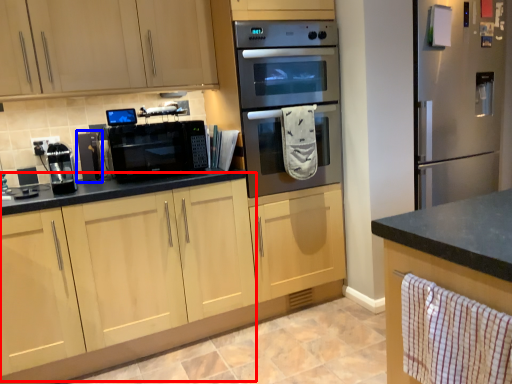
Question: Which of the following is the farthest to the observer, cabinetry (highlighted by a red box) or appliance (highlighted by a blue box)?

Choices:
 (A) cabinetry
 (B) appliance

Answer: (B)